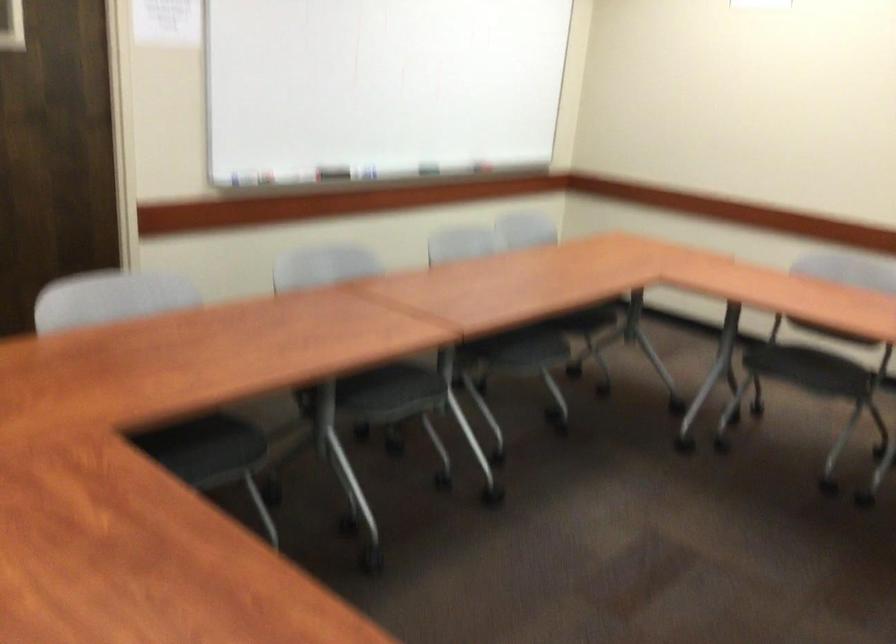
The images are taken continuously from a first-person perspective. In which direction is your viewpoint rotating?

The camera's rotation is toward right-down.